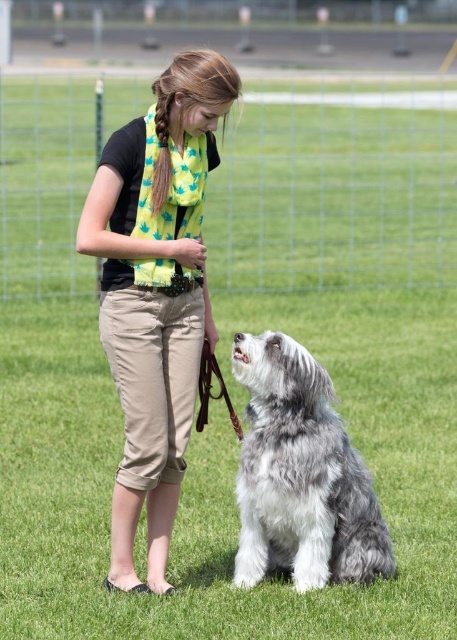
Question: Can you confirm if green scarf at center is bigger than fluffy gray fur at center?

Choices:
 (A) yes
 (B) no

Answer: (A)

Question: Does green scarf at center have a greater width compared to fluffy gray fur at center?

Choices:
 (A) no
 (B) yes

Answer: (A)

Question: Among these objects, which one is farthest from the camera?

Choices:
 (A) golden hair braid at upper center
 (B) green scarf at center

Answer: (A)

Question: Which is nearer to the golden hair braid at upper center?

Choices:
 (A) fluffy gray fur at center
 (B) green scarf at center

Answer: (B)

Question: Which of the following is the farthest from the observer?

Choices:
 (A) fluffy gray fur at center
 (B) green scarf at center

Answer: (A)

Question: Is green scarf at center smaller than fluffy gray fur at center?

Choices:
 (A) no
 (B) yes

Answer: (A)